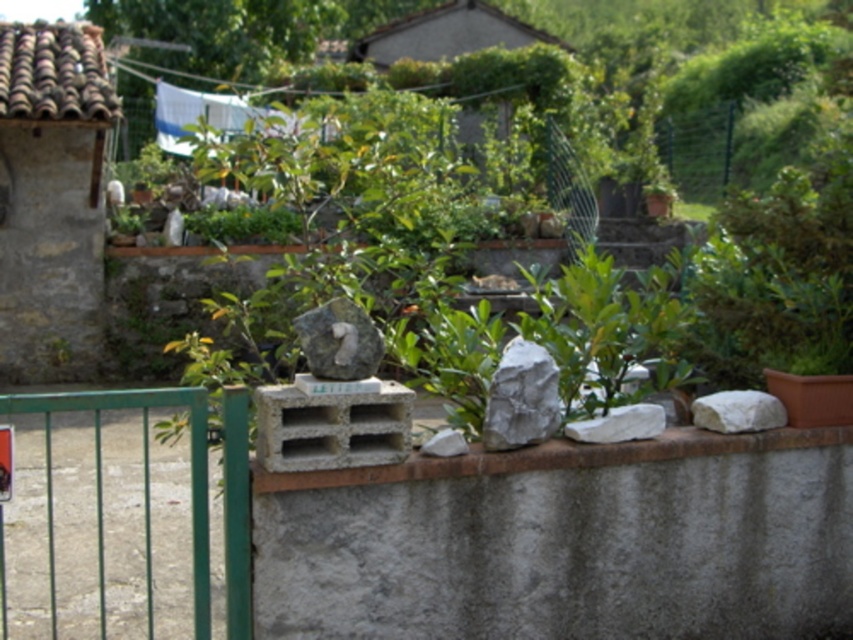
Question: Which object is positioned closest to the white smooth rock at center?

Choices:
 (A) green metal gate at left
 (B) white smooth rock at right
 (C) white matte rock at center
 (D) white rough rock at center

Answer: (D)

Question: Does green metal gate at left have a greater width compared to gray concrete crate at center?

Choices:
 (A) no
 (B) yes

Answer: (A)

Question: Does white smooth rock at right have a smaller size compared to white matte rock at center?

Choices:
 (A) yes
 (B) no

Answer: (B)

Question: In this image, where is gray concrete crate at center located relative to white smooth rock at right?

Choices:
 (A) below
 (B) above

Answer: (A)

Question: Which object is the farthest from the green metal gate at left?

Choices:
 (A) white smooth rock at center
 (B) gray stone at center
 (C) white rough rock at center

Answer: (A)

Question: Which point is farther to the camera?

Choices:
 (A) (534, 378)
 (B) (242, 464)
 (C) (355, 321)
 (D) (763, 412)

Answer: (D)